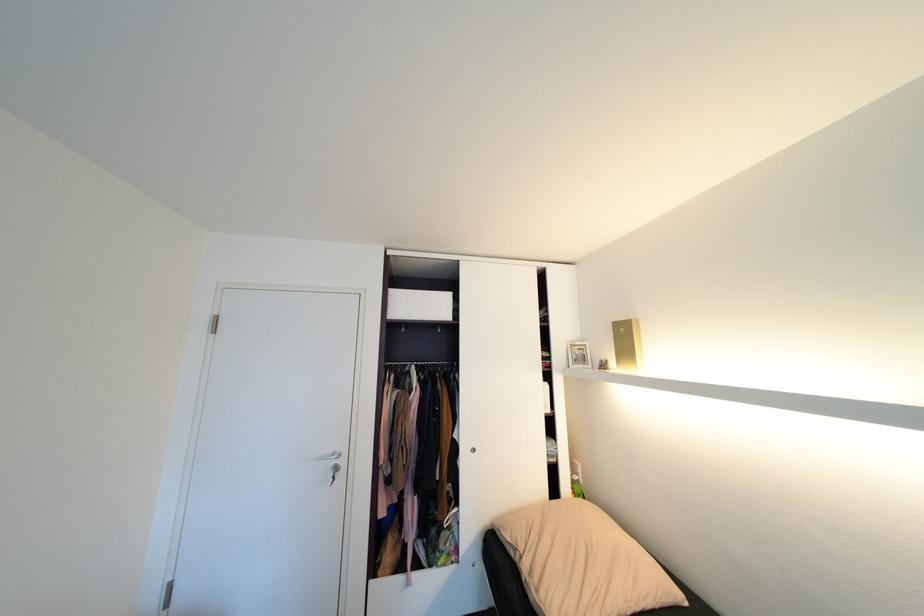
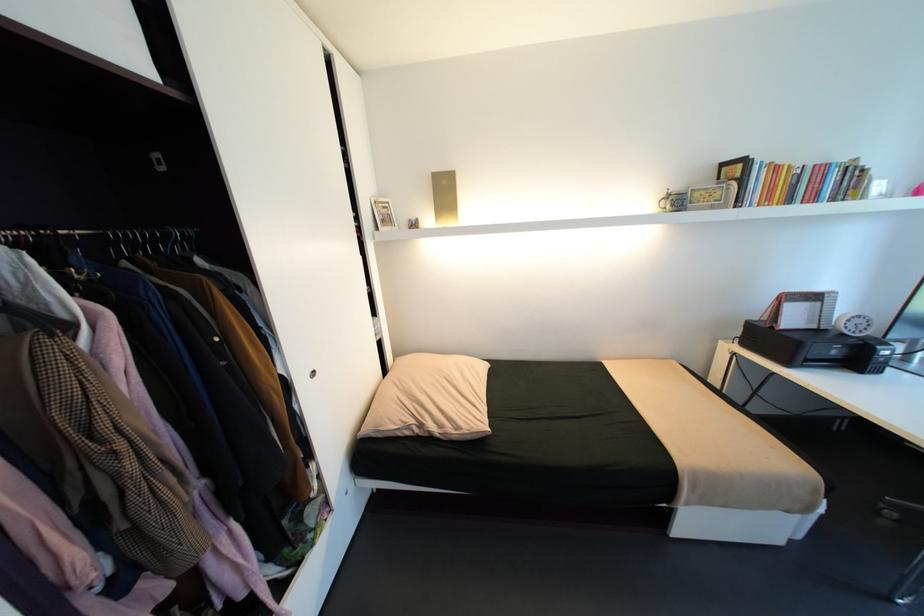
In the second image, find the point that corresponds to (x=587, y=350) in the first image.

(392, 208)